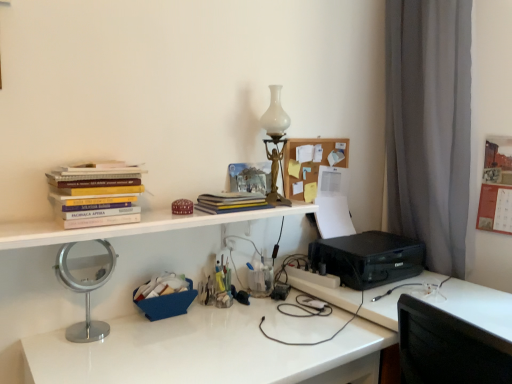
Identify the location of vacant area that is in front of blue fabric basket at center, arranged as the 1th stationery when ordered from the bottom. click(x=159, y=339).